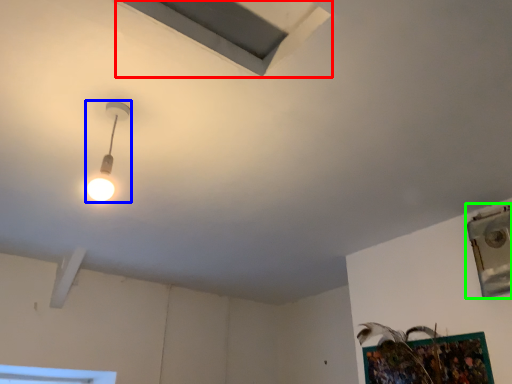
Question: Which object is positioned farthest from exhaust hood (highlighted by a red box)? Select from lamp (highlighted by a blue box) and window (highlighted by a green box).

Choices:
 (A) lamp
 (B) window

Answer: (B)